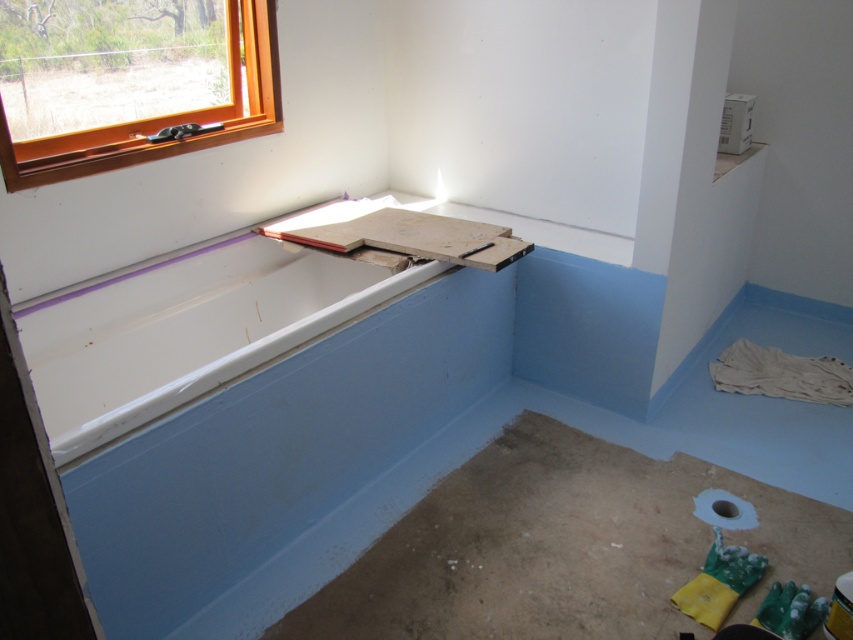
Who is taller, white glossy bathtub at upper left or orange wood window at upper left?

Standing taller between the two is orange wood window at upper left.

Does white glossy bathtub at upper left have a lesser height compared to orange wood window at upper left?

Yes, white glossy bathtub at upper left is shorter than orange wood window at upper left.

Is point (254, 282) behind point (131, 4)?

Yes, it is behind point (131, 4).

I want to click on white glossy bathtub at upper left, so click(x=186, y=332).